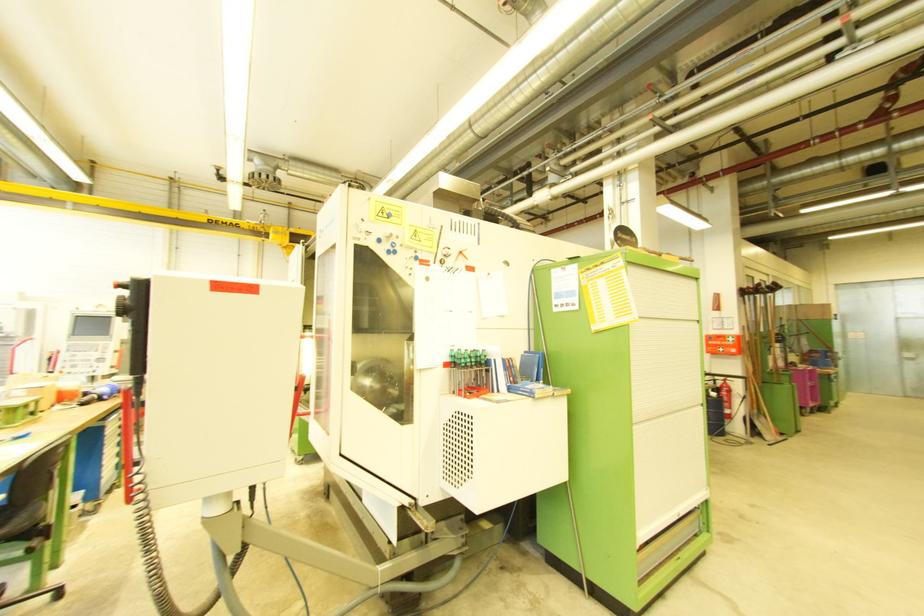
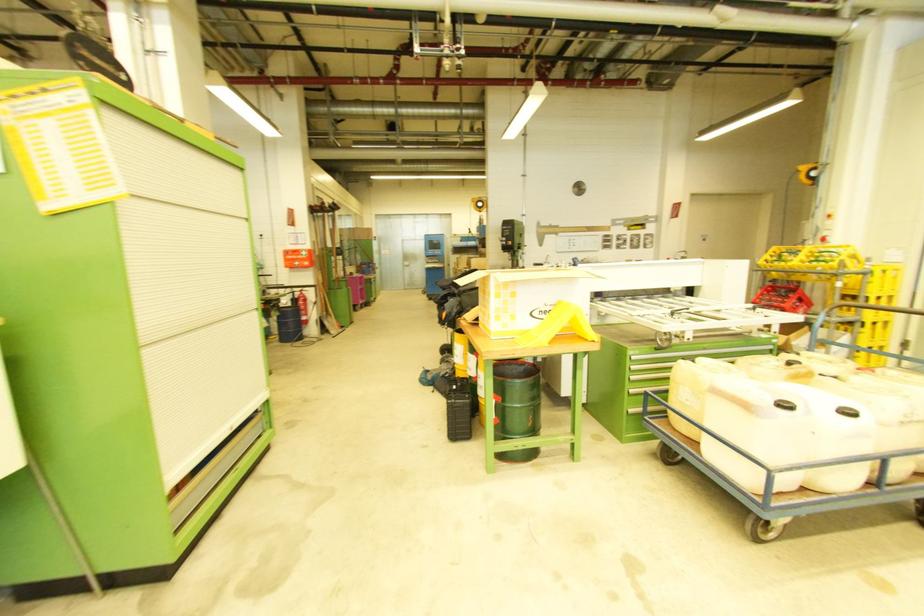
Locate, in the second image, the point that corresponds to point (727, 407) in the first image.

(306, 314)